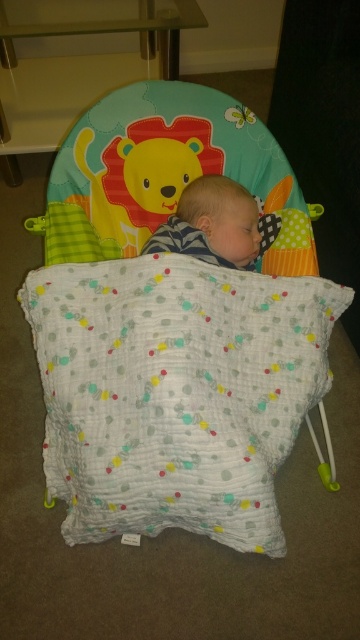
You are a new parent trying to place your baby into the soft cotton baby bed at center and the soft white blanket at center. Which item should you place first to ensure the baby stays warm and comfortable?

The soft white blanket at center should be placed first because the soft cotton baby bed at center is bigger than the soft white blanket at center, allowing the blanket to be properly positioned within the bed to keep the baby warm.

You are a parent looking at the baby bouncer and want to place a new toy near the soft cotton baby bed at center and the soft white blanket at center. According to the image, which object should you place the toy to the left of?

The soft cotton baby bed at center is positioned on the left side of the soft white blanket at center, so you should place the toy to the left of the soft white blanket at center.